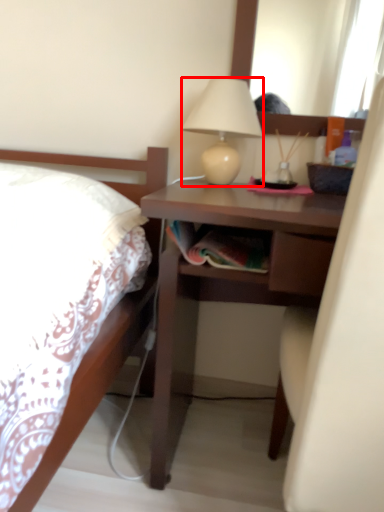
Question: From the image's perspective, what is the correct spatial relationship of lamp (annotated by the red box) in relation to desk?

Choices:
 (A) below
 (B) above

Answer: (B)